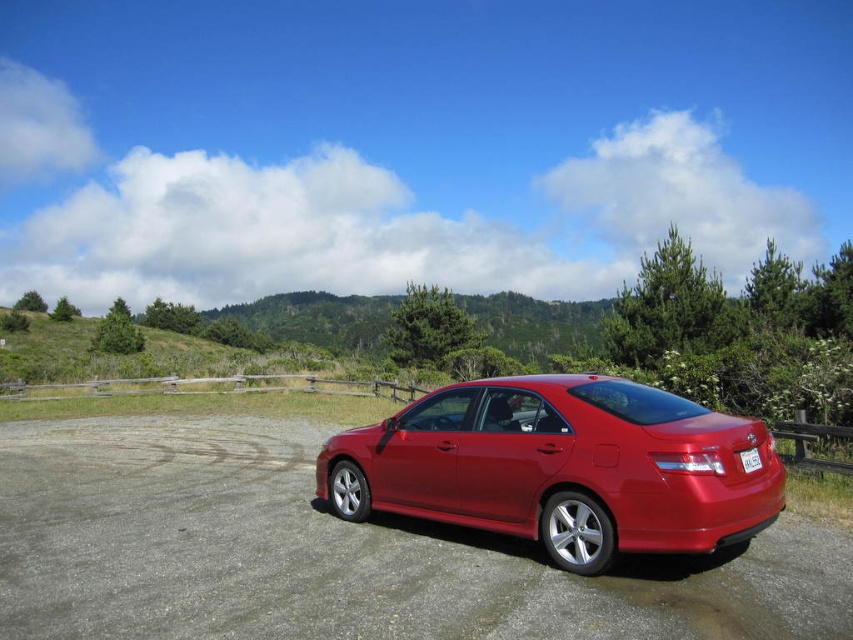
Does glossy metallic sedan at center have a lesser height compared to white plastic license plate at center?

Incorrect, glossy metallic sedan at center's height does not fall short of white plastic license plate at center's.

Locate an element on the screen. glossy metallic sedan at center is located at coordinates (561, 467).

Locate an element on the screen. This screenshot has height=640, width=853. glossy metallic sedan at center is located at coordinates (561, 467).

This screenshot has width=853, height=640. In order to click on glossy metallic sedan at center in this screenshot , I will do `click(561, 467)`.